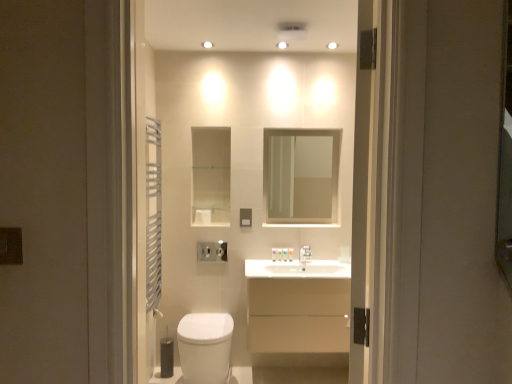
Question: Is white glossy toilet at center aimed at white matte toilet paper at center, which is counted as the 2th toilet paper, starting from the right?

Choices:
 (A) no
 (B) yes

Answer: (B)

Question: From a real-world perspective, does white glossy toilet at center sit lower than white matte toilet paper at center, the first toilet paper positioned from the top?

Choices:
 (A) no
 (B) yes

Answer: (A)

Question: Considering the relative sizes of white glossy toilet at center and white matte toilet paper at center, which is counted as the 2th toilet paper, starting from the bottom, in the image provided, is white glossy toilet at center shorter than white matte toilet paper at center, which is counted as the 2th toilet paper, starting from the bottom,?

Choices:
 (A) yes
 (B) no

Answer: (B)

Question: Does white glossy toilet at center have a greater height compared to white matte toilet paper at center, the first toilet paper positioned from the top?

Choices:
 (A) no
 (B) yes

Answer: (B)

Question: Is white glossy toilet at center not within white matte toilet paper at center, the first toilet paper positioned from the top?

Choices:
 (A) yes
 (B) no

Answer: (A)

Question: Is the surface of white glossy toilet at center in direct contact with white matte toilet paper at center, the first toilet paper positioned from the top?

Choices:
 (A) no
 (B) yes

Answer: (A)

Question: Is matte black switch at left, positioned as the 1th electric outlet in left-to-right order, at the right side of clear glass mirror at upper center?

Choices:
 (A) yes
 (B) no

Answer: (B)

Question: Is matte black switch at left, arranged as the 2th electric outlet when viewed from the right, turned away from clear glass mirror at upper center?

Choices:
 (A) no
 (B) yes

Answer: (A)

Question: Can you confirm if matte black switch at left, positioned as the 1th electric outlet in left-to-right order, is shorter than clear glass mirror at upper center?

Choices:
 (A) yes
 (B) no

Answer: (A)

Question: Is matte black switch at left, the second electric outlet in the back-to-front sequence, bigger than clear glass mirror at upper center?

Choices:
 (A) yes
 (B) no

Answer: (B)

Question: From the image's perspective, is matte black switch at left, positioned as the 1th electric outlet in left-to-right order, beneath clear glass mirror at upper center?

Choices:
 (A) yes
 (B) no

Answer: (A)

Question: Is matte black switch at left, positioned as the 1th electric outlet in left-to-right order, beside clear glass mirror at upper center?

Choices:
 (A) no
 (B) yes

Answer: (A)

Question: From the image's perspective, is white matte toilet paper at right, which is counted as the 2th toilet paper, starting from the top, located beneath beige matte cabinet at center?

Choices:
 (A) yes
 (B) no

Answer: (B)